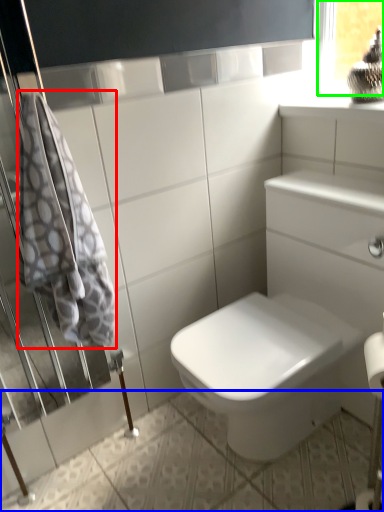
Question: Based on their relative distances, which object is farther from bath towel (highlighted by a red box)? Choose from ceramic tile (highlighted by a blue box) and window frame (highlighted by a green box).

Choices:
 (A) ceramic tile
 (B) window frame

Answer: (B)